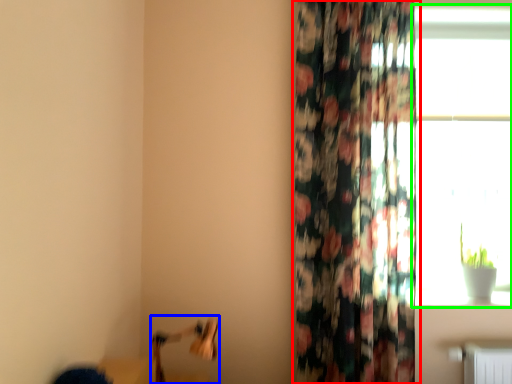
Question: Considering the real-world distances, which object is closest to curtain (highlighted by a red box)? swivel chair (highlighted by a blue box) or window (highlighted by a green box).

Choices:
 (A) swivel chair
 (B) window

Answer: (B)